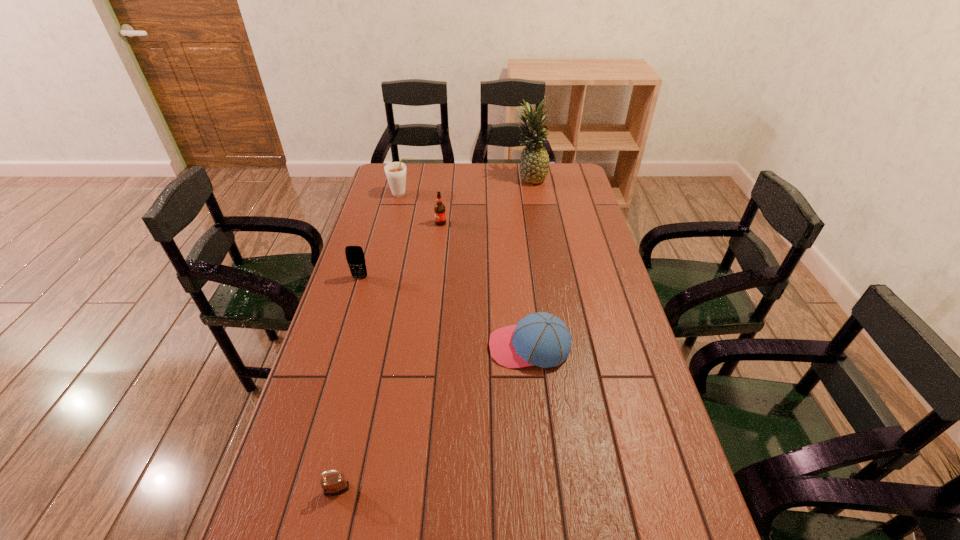
This screenshot has width=960, height=540. Identify the location of the nearest object. (334, 484).

Find the location of a particular element. The image size is (960, 540). free space located on the right of the pineapple is located at coordinates (578, 178).

Locate an element on the screen. The width and height of the screenshot is (960, 540). free space located 0.300m on the drink side of the second farthest object is located at coordinates (486, 194).

You are a GUI agent. You are given a task and a screenshot of the screen. Output one action in this format:
    pyautogui.click(x=<x>, y=<y>)
    Task: Click on the vacant region located 0.400m on the front of the nearer root beer
    This screenshot has height=540, width=960.
    Given the screenshot: What is the action you would take?
    pyautogui.click(x=432, y=299)

The image size is (960, 540). In order to click on vacant space situated 0.340m on the screen of the cellular telephone in this screenshot , I will do `click(335, 361)`.

The height and width of the screenshot is (540, 960). Find the location of `free space located on the front-facing side of the baseball cap`. free space located on the front-facing side of the baseball cap is located at coordinates (447, 347).

At what (x,y) coordinates should I click in order to perform the action: click on vacant region located 0.100m on the front-facing side of the baseball cap. Please return your answer as a coordinate pair (x, y). The image size is (960, 540). Looking at the image, I should click on (454, 347).

Locate an element on the screen. vacant space situated 0.270m on the front-facing side of the baseball cap is located at coordinates (396, 347).

Image resolution: width=960 pixels, height=540 pixels. I want to click on vacant space located on the back of the nearest object, so click(362, 384).

Image resolution: width=960 pixels, height=540 pixels. Identify the location of pineapple located in the far edge section of the desktop. (534, 163).